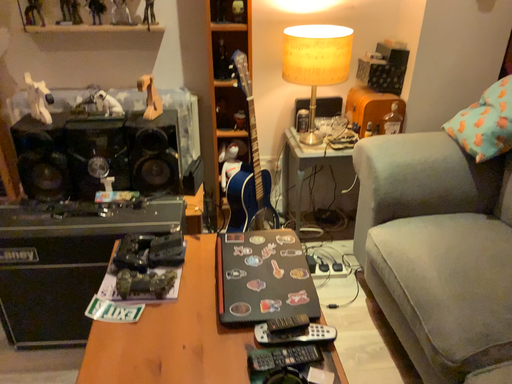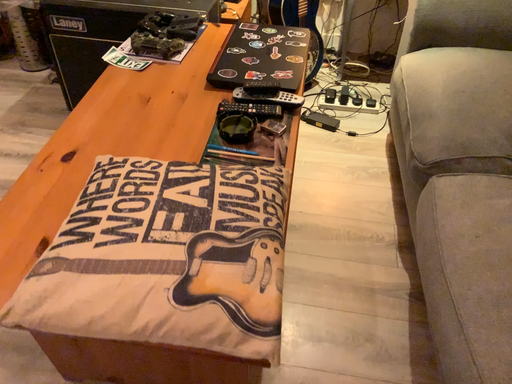
Question: Which way did the camera rotate in the video?

Choices:
 (A) rotated upward
 (B) rotated downward

Answer: (B)